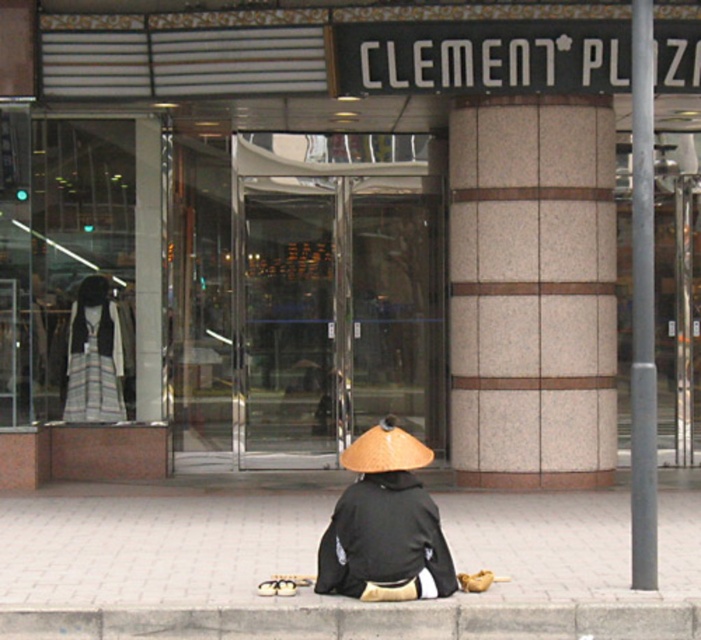
Between smooth concrete pavement at lower center and striped cotton sweatshirt at center, which one appears on the left side from the viewer's perspective?

striped cotton sweatshirt at center

Is point (540, 499) closer to viewer compared to point (115, 371)?

Yes, it is.

Is point (128, 518) behind point (122, 371)?

No, it is not.

Find the location of a particular element. The width and height of the screenshot is (701, 640). smooth concrete pavement at lower center is located at coordinates (151, 547).

Is metallic gray pole at right shorter than striped cotton sweatshirt at center?

No, metallic gray pole at right is not shorter than striped cotton sweatshirt at center.

Is point (651, 40) positioned after point (109, 314)?

No, it is not.

What do you see at coordinates (641, 305) in the screenshot? Image resolution: width=701 pixels, height=640 pixels. I see `metallic gray pole at right` at bounding box center [641, 305].

Where is `metallic gray pole at right`? This screenshot has width=701, height=640. metallic gray pole at right is located at coordinates (641, 305).

Is smooth concrete pavement at lower center bigger than metallic gray pole at right?

Incorrect, smooth concrete pavement at lower center is not larger than metallic gray pole at right.

Can you confirm if smooth concrete pavement at lower center is wider than metallic gray pole at right?

Yes.

Is point (299, 531) farther from viewer compared to point (651, 138)?

Yes, it is.

This screenshot has width=701, height=640. Find the location of `smooth concrete pavement at lower center`. smooth concrete pavement at lower center is located at coordinates (151, 547).